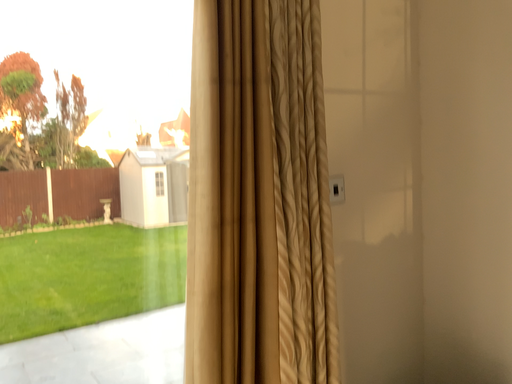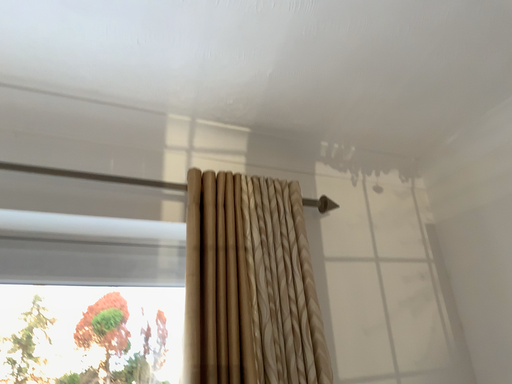
Question: Which way did the camera rotate in the video?

Choices:
 (A) rotated right
 (B) rotated left

Answer: (B)